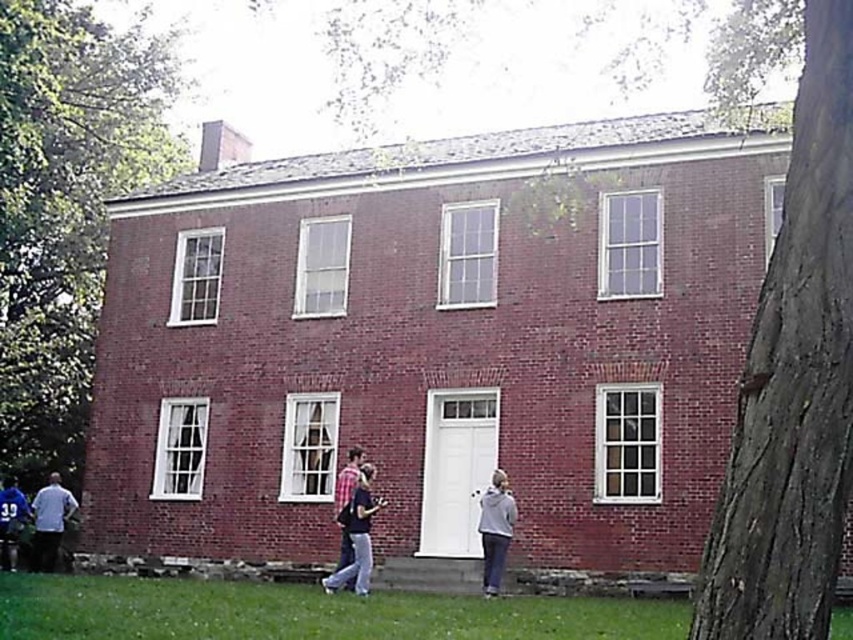
You are standing in front of the two story brick building and see the gray fleece jacket at lower right and the light blue shirt at lower left. Which one is nearer to you?

The gray fleece jacket at lower right is closer to the viewer than the light blue shirt at lower left.

You are a photographer trying to capture a group photo of the people in front of the two story brick building. You need to ensure everyone fits in the frame. The camera you are using has a maximum width capacity of 1.5 meters. Given the gray fleece jacket at lower right and the light blue shirt at lower left are at the edges of the group, can you fit everyone in the frame?

The gray fleece jacket at lower right is narrower than the light blue shirt at lower left, so the total width between them is less than 1.5 meters. Therefore, everyone can fit in the frame.

You are a visitor approaching the building and notice the brown rough bark tree at right and the light blue shirt at lower left. Which object is larger in size?

The brown rough bark tree at right is bigger than the light blue shirt at lower left according to the description.